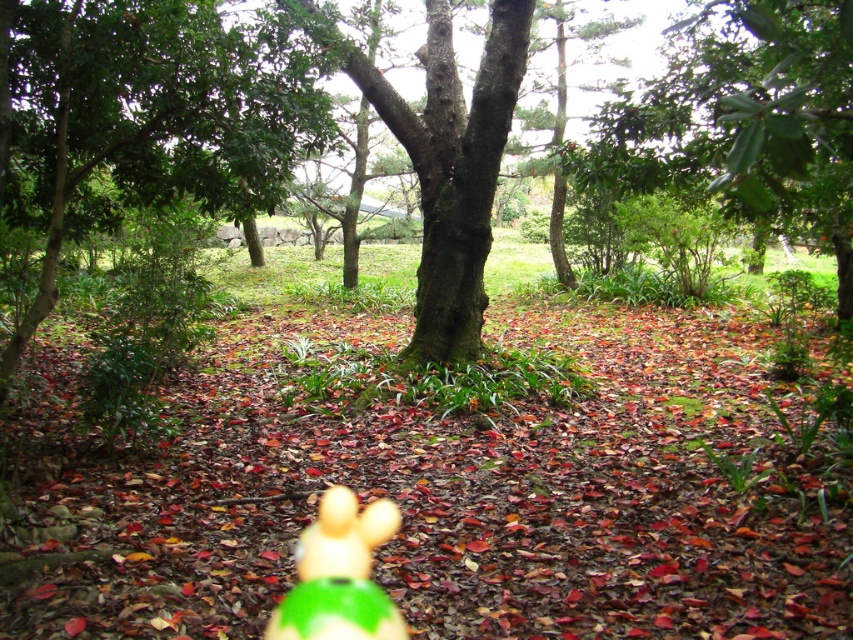
You are planning to take a photo of the green leafy tree at upper right and the green matte toy at center in the park. Which object should you focus on first if you want to capture both in the same frame without moving the camera?

The green leafy tree at upper right should be focused on first because it is smaller in size compared to the green matte toy at center, allowing the camera to adjust to the closer or farther distance needed to include both in the frame.

You are a child who wants to pick up the green matte toy at center from where you are standing next to the green leafy tree at center. How many steps do you need to take to reach it?

The distance between the green leafy tree at center and the green matte toy at center is 2.89 meters. Assuming an average step length of about 0.7 meters, you would need approximately 4 steps to reach the green matte toy at center.